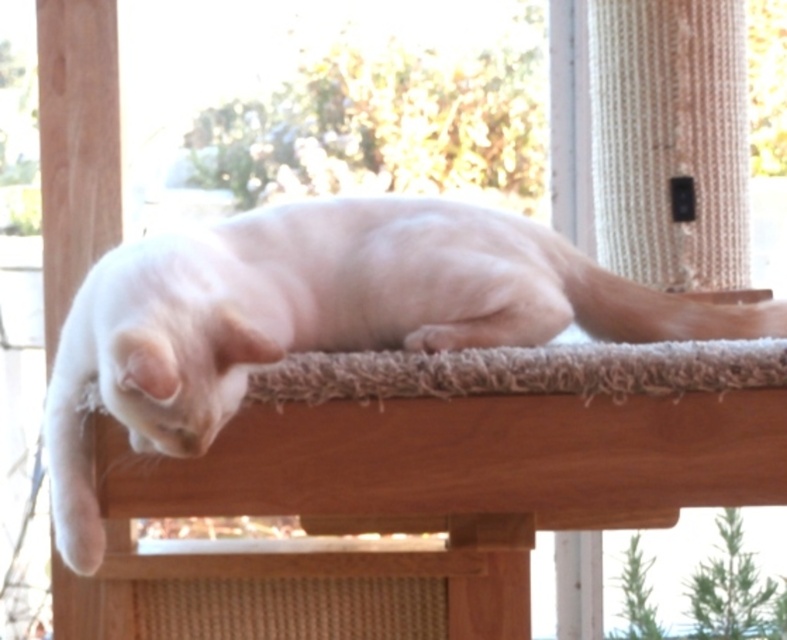
Question: Which point is farther from the camera taking this photo?

Choices:
 (A) 429,260
 (B) 501,369

Answer: (A)

Question: Which point is farther to the camera?

Choices:
 (A) shaggy beige carpet at center
 (B) white fur cat at center

Answer: (A)

Question: Does white fur cat at center appear under shaggy beige carpet at center?

Choices:
 (A) no
 (B) yes

Answer: (A)

Question: Can you confirm if white fur cat at center is smaller than shaggy beige carpet at center?

Choices:
 (A) no
 (B) yes

Answer: (A)

Question: Is white fur cat at center closer to the viewer compared to shaggy beige carpet at center?

Choices:
 (A) no
 (B) yes

Answer: (B)